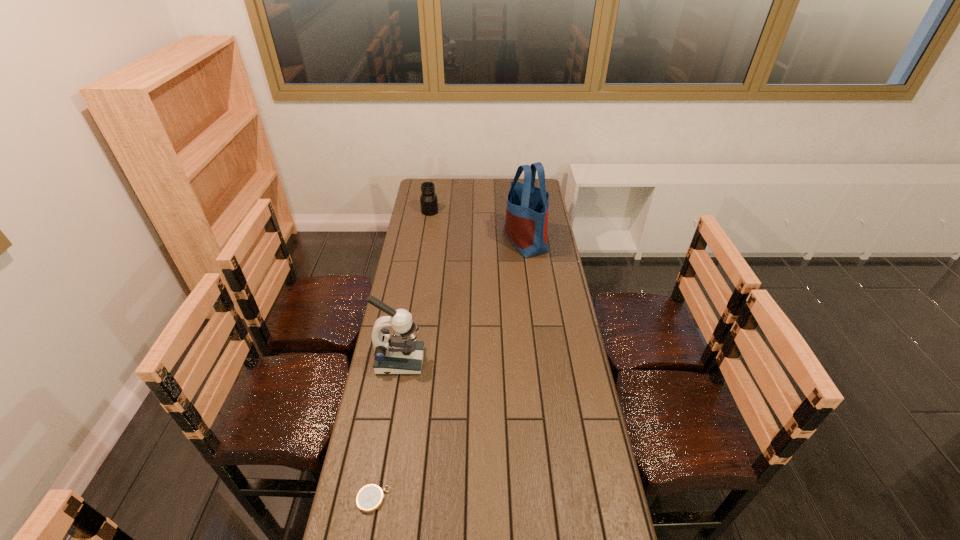
Identify the location of free space between the second farthest object and the third tallest object. (477, 226).

The height and width of the screenshot is (540, 960). Identify the location of free point between the third tallest object and the handbag. (477, 226).

I want to click on vacant point located between the third tallest object and the microscope, so click(415, 286).

The width and height of the screenshot is (960, 540). I want to click on vacant region between the farthest object and the third shortest object, so (x=415, y=286).

In order to click on blank region between the tallest object and the shortest object in this screenshot , I will do `click(449, 370)`.

Where is `free area in between the third nearest object and the microscope`? free area in between the third nearest object and the microscope is located at coordinates (463, 301).

The width and height of the screenshot is (960, 540). What are the coordinates of `empty location between the shortest object and the rightmost object` in the screenshot? It's located at (449, 370).

At what (x,y) coordinates should I click in order to perform the action: click on vacant space that's between the compass and the microscope. Please return your answer as a coordinate pair (x, y). This screenshot has height=540, width=960. Looking at the image, I should click on (387, 430).

Identify the location of free point between the nearest object and the microscope. (387, 430).

Identify the location of object that can be found as the closest to the nearest object. (401, 354).